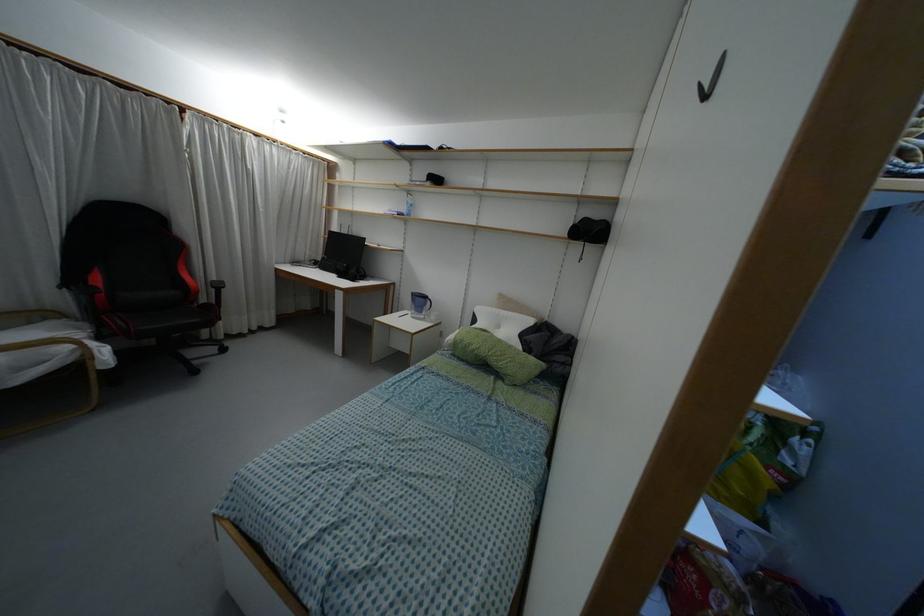
Image resolution: width=924 pixels, height=616 pixels. I want to click on green bolster pillow, so click(x=492, y=354).